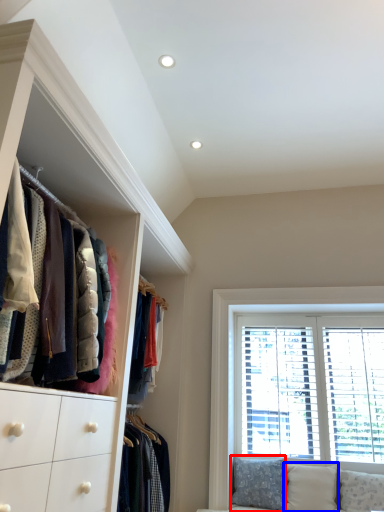
Question: Which of the following is the closest to the observer, pillow (highlighted by a red box) or pillow (highlighted by a blue box)?

Choices:
 (A) pillow
 (B) pillow

Answer: (B)